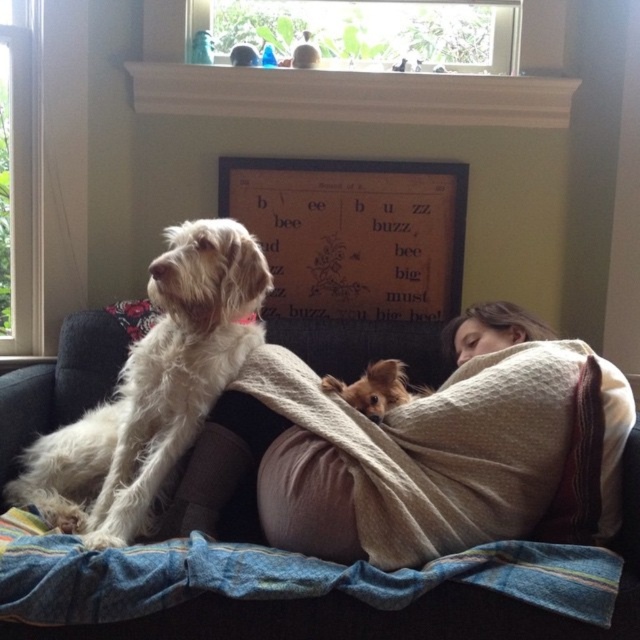
Question: Which object appears closest to the camera in this image?

Choices:
 (A) brown fuzzy dog at lower center
 (B) wooden bulletin board at center
 (C) beige knitted blanket at center
 (D) skinny beige fabric at center

Answer: (C)

Question: Which object appears closest to the camera in this image?

Choices:
 (A) wooden bulletin board at center
 (B) soft fabric couch at center
 (C) denim fabric blanket at lower center

Answer: (C)

Question: Can you confirm if denim fabric blanket at lower center is smaller than soft fabric couch at center?

Choices:
 (A) no
 (B) yes

Answer: (B)

Question: Estimate the real-world distances between objects in this image. Which object is closer to the wooden bulletin board at center?

Choices:
 (A) soft fabric couch at center
 (B) skinny beige fabric at center
 (C) white fluffy dog at left

Answer: (C)

Question: Where is skinny beige fabric at center located in relation to brown fuzzy dog at lower center in the image?

Choices:
 (A) below
 (B) above

Answer: (A)

Question: Can you confirm if soft fabric couch at center is positioned above brown fuzzy dog at lower center?

Choices:
 (A) yes
 (B) no

Answer: (B)